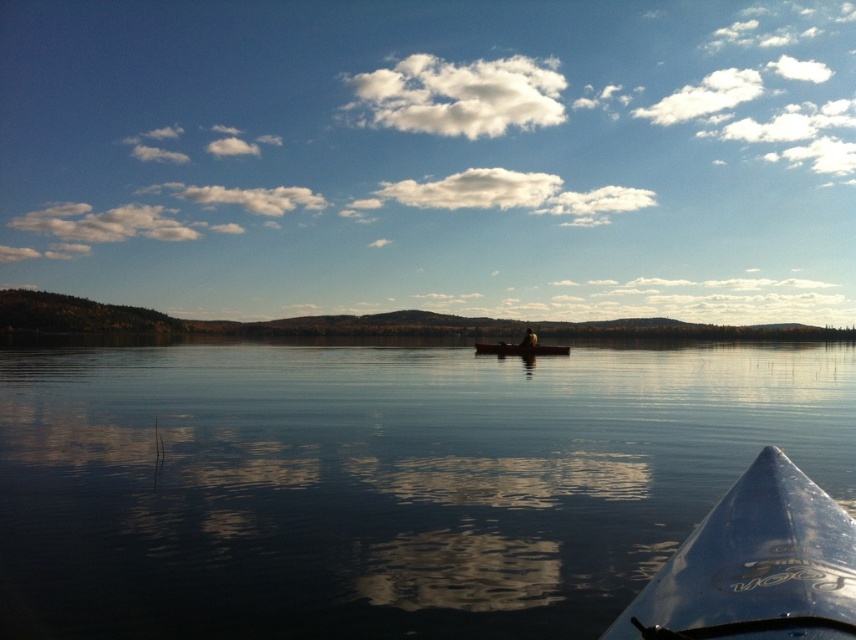
Question: Which object is the farthest from the matte black canoe at center?

Choices:
 (A) transparent water at center
 (B) dark brown leather jacket at center
 (C) blue plastic kayak at lower right

Answer: (C)

Question: Does transparent water at center appear on the right side of matte black canoe at center?

Choices:
 (A) yes
 (B) no

Answer: (B)

Question: Based on their relative distances, which object is farther from the transparent water at center?

Choices:
 (A) blue plastic kayak at lower right
 (B) matte black canoe at center
 (C) dark brown leather jacket at center

Answer: (A)

Question: Which point is farther from the camera taking this photo?

Choices:
 (A) (566, 348)
 (B) (0, 435)

Answer: (A)

Question: Is transparent water at center bigger than matte black canoe at center?

Choices:
 (A) yes
 (B) no

Answer: (A)

Question: Observing the image, what is the correct spatial positioning of matte black canoe at center in reference to dark brown leather jacket at center?

Choices:
 (A) left
 (B) right

Answer: (A)